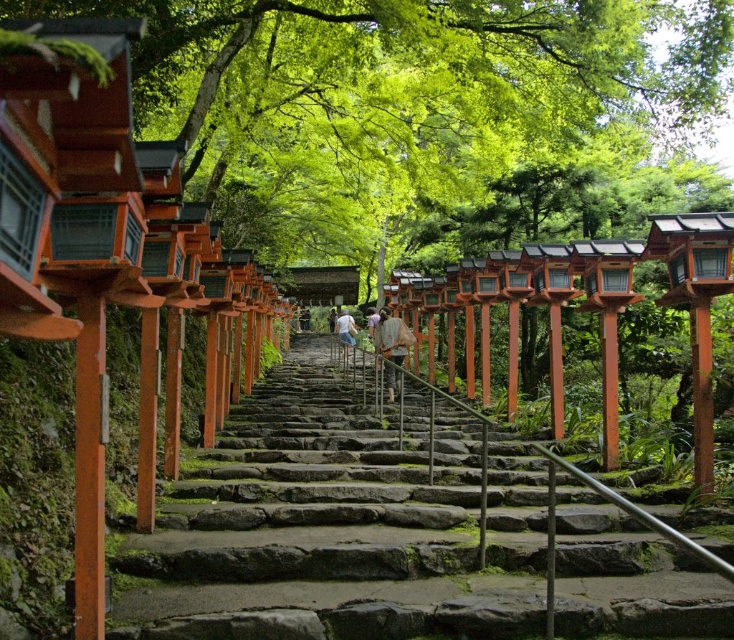
Between smooth stone stairs at center and matte orange torii gate at center, which one has less height?

Standing shorter between the two is smooth stone stairs at center.

Between point (501, 435) and point (399, 349), which one is positioned behind?

Positioned behind is point (399, 349).

The image size is (734, 640). I want to click on smooth stone stairs at center, so click(341, 524).

Is green leafy tree at upper center behind smooth stone stairs at center?

No, it is in front of smooth stone stairs at center.

Is point (559, 134) less distant than point (297, 628)?

No, (559, 134) is further to viewer.

The height and width of the screenshot is (640, 734). Identify the location of green leafy tree at upper center. (426, 116).

Between smooth stone stairs at center and light brown wooden post at center, which one is positioned lower?

smooth stone stairs at center is lower down.

Does smooth stone stairs at center appear over light brown wooden post at center?

No, smooth stone stairs at center is not above light brown wooden post at center.

Does point (401, 470) come farther from viewer compared to point (346, 339)?

That is False.

Locate an element on the screen. smooth stone stairs at center is located at coordinates (341, 524).